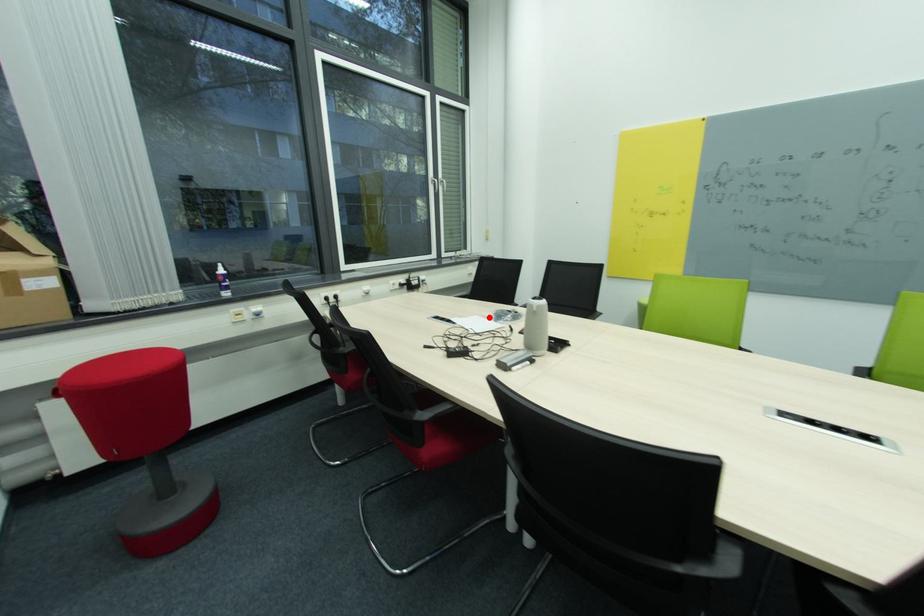
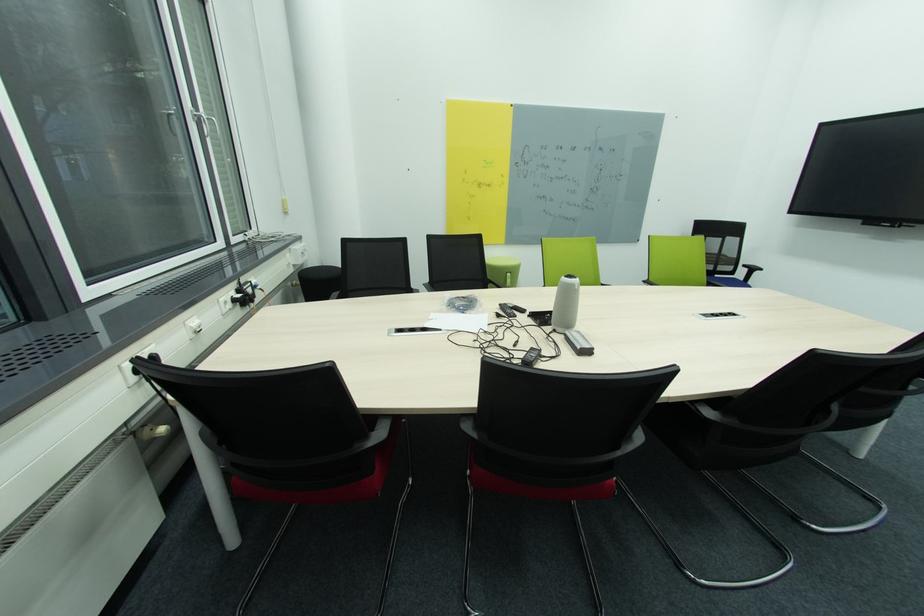
Find the pixel in the second image that matches the highlighted location in the first image.

(444, 313)